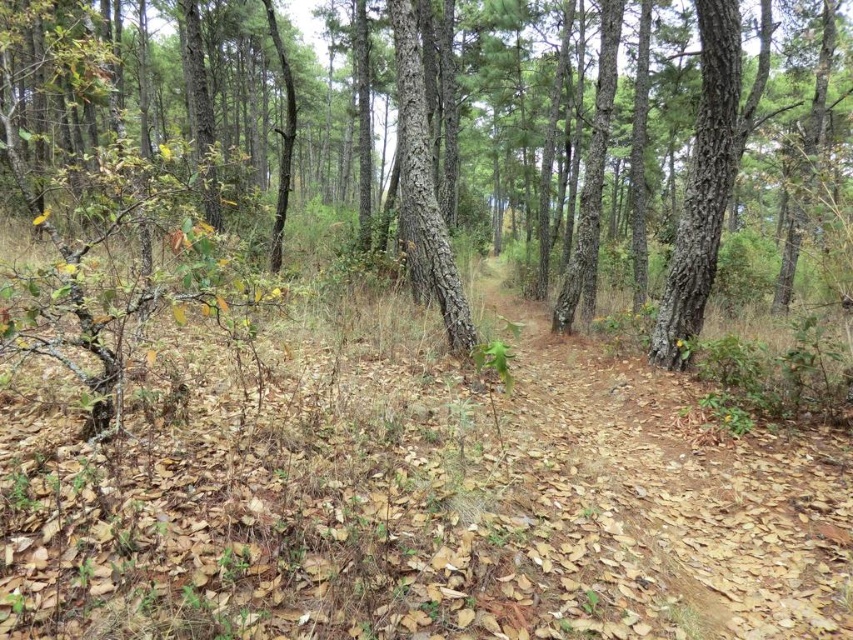
You are standing at the origin point in the forest scene. The brown rough tree at center is located at coordinates point 0.289, 0.089. If you want to reach the tree, what direction should you move in?

The brown rough tree at center is located at coordinates point (74, 184). Since the coordinates are positive in both x and y directions from the origin, you should move northeast to reach the tree.

You are standing at the origin point in the forest. There is a brown rough tree at center. Can you determine its exact location based on the coordinates provided?

The brown rough tree at center is located at point (74,184).